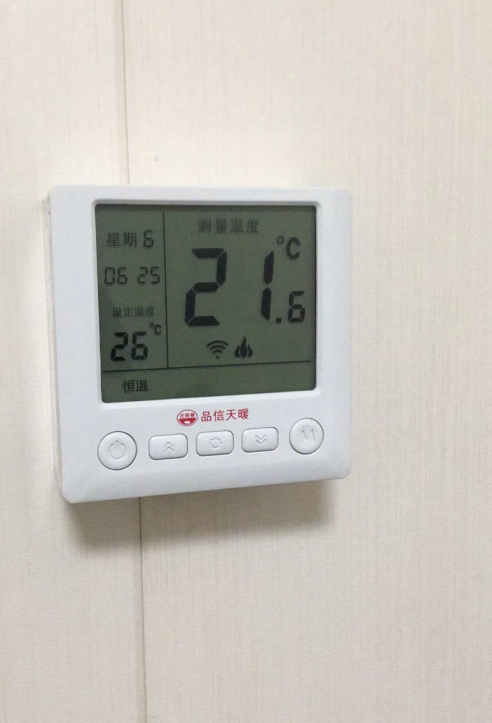
This screenshot has width=492, height=723. I want to click on shadow from thermostat, so click(x=205, y=517).